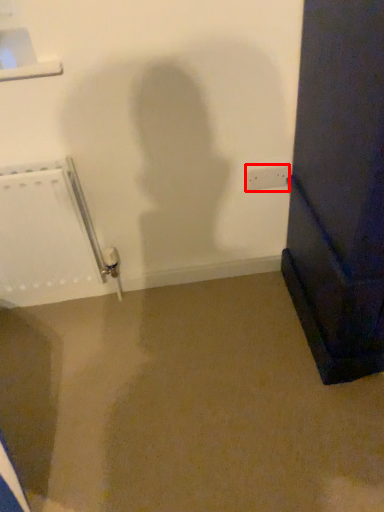
Question: Where is electric outlet (annotated by the red box) located in relation to radiator in the image?

Choices:
 (A) right
 (B) left

Answer: (A)